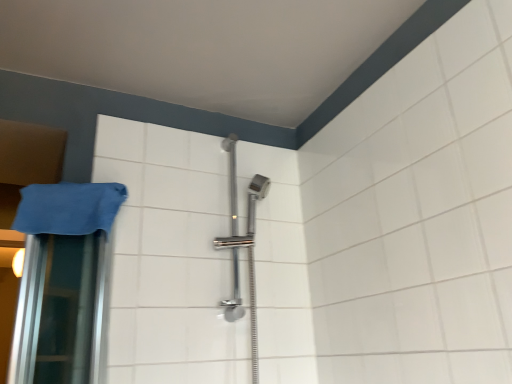
What do you see at coordinates (68, 208) in the screenshot?
I see `blue fabric towel at left` at bounding box center [68, 208].

Locate an element on the screen. The width and height of the screenshot is (512, 384). blue fabric towel at left is located at coordinates (68, 208).

Find the location of a particular element. blue fabric towel at left is located at coordinates (68, 208).